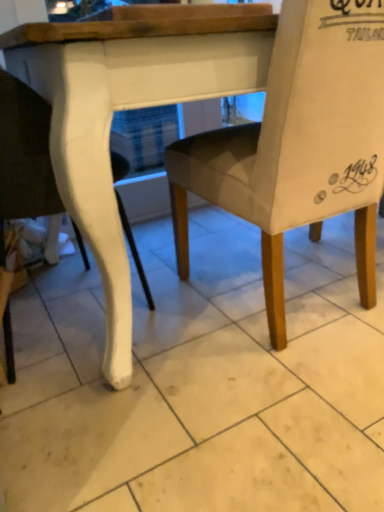
Question: Is white glossy tile at center inside white glossy chair leg at left, which ranks as the 1th chair in left-to-right order?

Choices:
 (A) no
 (B) yes

Answer: (A)

Question: Does white glossy chair leg at left, which ranks as the 1th chair in left-to-right order, have a greater height compared to white glossy tile at center?

Choices:
 (A) yes
 (B) no

Answer: (A)

Question: Is white glossy chair leg at left, which ranks as the 1th chair in left-to-right order, facing away from white glossy tile at center?

Choices:
 (A) no
 (B) yes

Answer: (A)

Question: From a real-world perspective, is white glossy chair leg at left, the 2th chair positioned from the right, beneath white glossy tile at center?

Choices:
 (A) yes
 (B) no

Answer: (B)

Question: Could you tell me if white glossy chair leg at left, the 2th chair positioned from the right, is turned towards white glossy tile at center?

Choices:
 (A) yes
 (B) no

Answer: (A)

Question: Is white glossy tile at center in front of or behind white glossy chair leg at left, which ranks as the 1th chair in left-to-right order, in the image?

Choices:
 (A) front
 (B) behind

Answer: (A)

Question: Considering the positions of white glossy tile at center and white glossy chair leg at left, which ranks as the 1th chair in left-to-right order, in the image, is white glossy tile at center taller or shorter than white glossy chair leg at left, which ranks as the 1th chair in left-to-right order,?

Choices:
 (A) tall
 (B) short

Answer: (B)

Question: From the image's perspective, is white glossy tile at center positioned above or below white glossy chair leg at left, which ranks as the 1th chair in left-to-right order?

Choices:
 (A) above
 (B) below

Answer: (B)

Question: Is white glossy tile at center inside or outside of white glossy chair leg at left, the 2th chair positioned from the right?

Choices:
 (A) inside
 (B) outside

Answer: (B)

Question: In the image, is light gray fabric chair at center, which appears as the first chair when viewed from the right, positioned in front of or behind white glossy chair leg at left, the 2th chair positioned from the right?

Choices:
 (A) behind
 (B) front

Answer: (B)

Question: Looking at their shapes, would you say light gray fabric chair at center, which appears as the first chair when viewed from the right, is wider or thinner than white glossy chair leg at left, which ranks as the 1th chair in left-to-right order?

Choices:
 (A) thin
 (B) wide

Answer: (B)

Question: Is light gray fabric chair at center, which appears as the first chair when viewed from the right, inside or outside of white glossy chair leg at left, the 2th chair positioned from the right?

Choices:
 (A) outside
 (B) inside

Answer: (A)

Question: Does point (299, 7) appear closer or farther from the camera than point (3, 173)?

Choices:
 (A) closer
 (B) farther

Answer: (A)

Question: From a real-world perspective, is white glossy chair leg at left, the 2th chair positioned from the right, above or below light gray fabric chair at center, which appears as the first chair when viewed from the right?

Choices:
 (A) below
 (B) above

Answer: (A)

Question: Relative to light gray fabric chair at center, the second chair in the left-to-right sequence, is white glossy chair leg at left, the 2th chair positioned from the right, in front or behind?

Choices:
 (A) front
 (B) behind

Answer: (B)